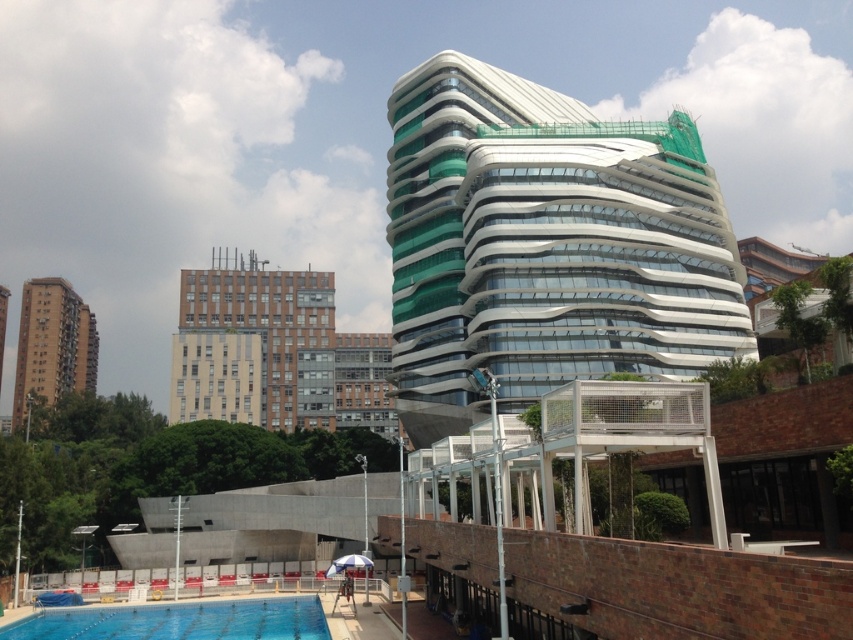
You are a city planner evaluating the skyline. Based on the image, which building is taller between the white glass building at center and the brown concrete building at left?

The white glass building at center is taller than the brown concrete building at left according to the description.